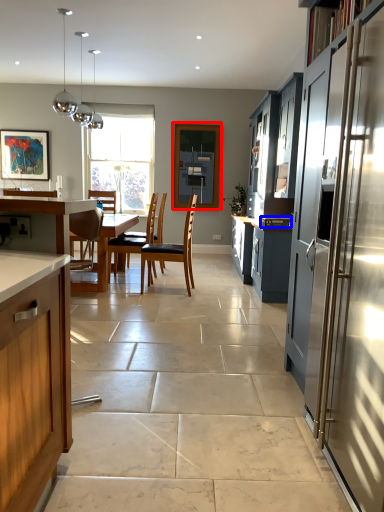
Question: Which of the following is the closest to the observer, window screen (highlighted by a red box) or appliance (highlighted by a blue box)?

Choices:
 (A) window screen
 (B) appliance

Answer: (B)